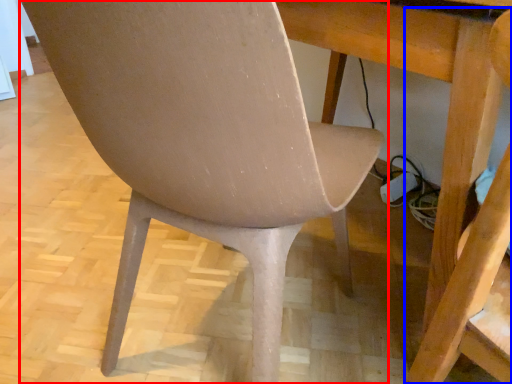
Question: Which object is further to the camera taking this photo, chair (highlighted by a red box) or swivel chair (highlighted by a blue box)?

Choices:
 (A) chair
 (B) swivel chair

Answer: (A)